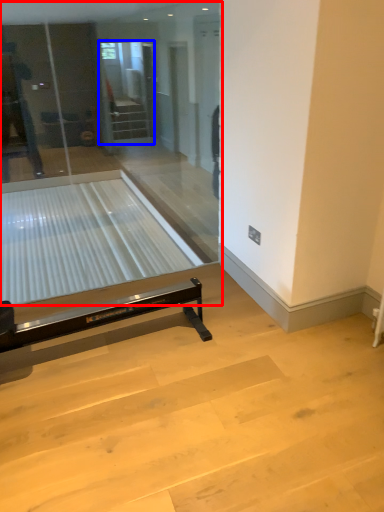
Question: Which of the following is the closest to the observer, glass door (highlighted by a red box) or screen door (highlighted by a blue box)?

Choices:
 (A) glass door
 (B) screen door

Answer: (A)